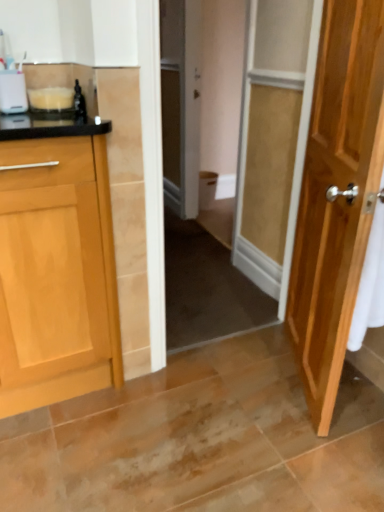
I want to click on white plastic container at left, so click(x=51, y=99).

What do you see at coordinates (51, 99) in the screenshot? Image resolution: width=384 pixels, height=512 pixels. I see `white plastic container at left` at bounding box center [51, 99].

From the picture: What is the approximate width of white plastic container at left?

It is 6.01 inches.

The height and width of the screenshot is (512, 384). I want to click on white plastic container at left, so click(51, 99).